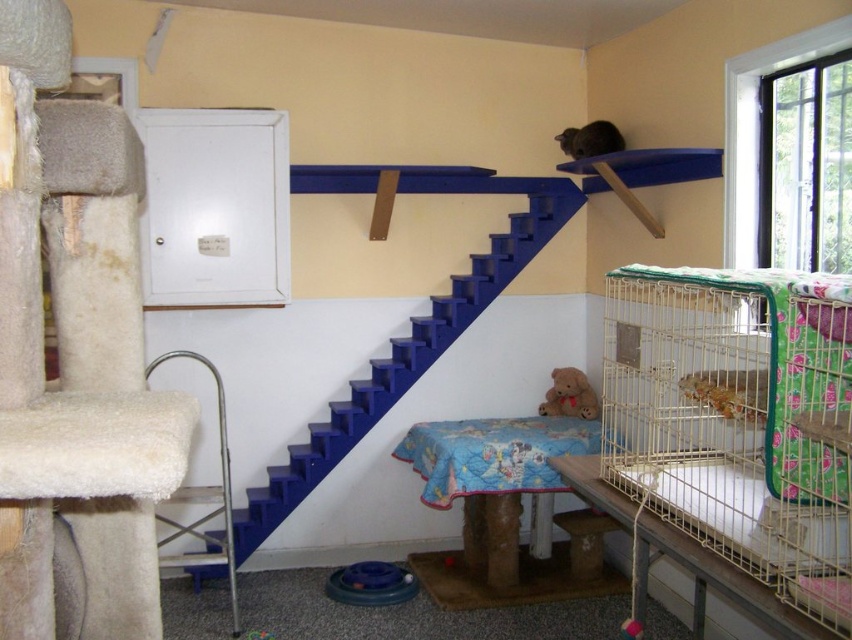
Question: Can you confirm if blue painted stairs at center is wider than orange textured lizard at center?

Choices:
 (A) no
 (B) yes

Answer: (B)

Question: Which point is farther from the camera taking this photo?

Choices:
 (A) (320, 468)
 (B) (746, 412)
 (C) (654, 512)

Answer: (A)

Question: Can you confirm if white wire birdcage at right is bigger than orange textured lizard at center?

Choices:
 (A) yes
 (B) no

Answer: (A)

Question: Estimate the real-world distances between objects in this image. Which object is closer to the brown plush teddy bear at lower center?

Choices:
 (A) white wire birdcage at right
 (B) orange textured lizard at center
 (C) blue painted stairs at center
 (D) brown furry cat at upper center

Answer: (C)

Question: Where is blue painted stairs at center located in relation to orange textured lizard at center in the image?

Choices:
 (A) right
 (B) left

Answer: (B)

Question: Which of these objects is positioned farthest from the brown furry cat at upper center?

Choices:
 (A) orange textured lizard at center
 (B) blue painted stairs at center

Answer: (A)